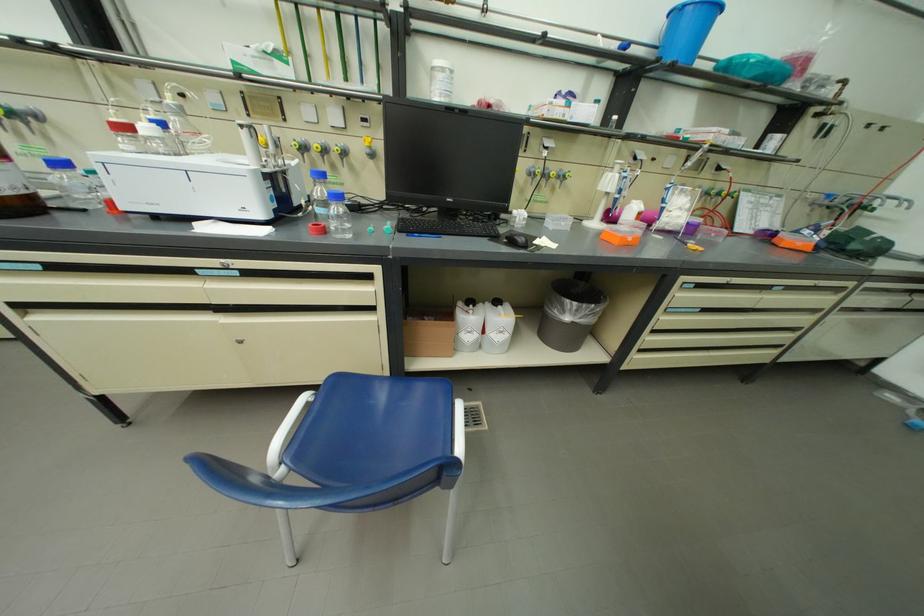
Which object does [569,314] point to?

This point indicates the grey trash can.